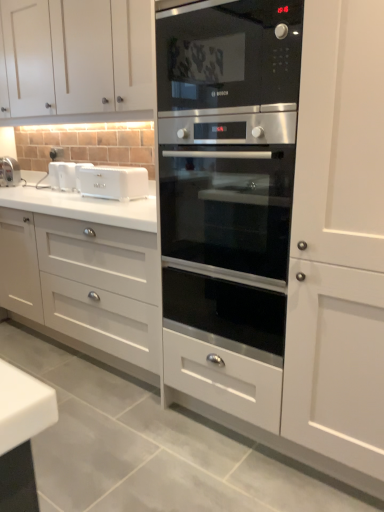
This screenshot has height=512, width=384. I want to click on free spot in front of white plastic toaster at left, arranged as the 2th appliance when viewed from the right, so click(51, 190).